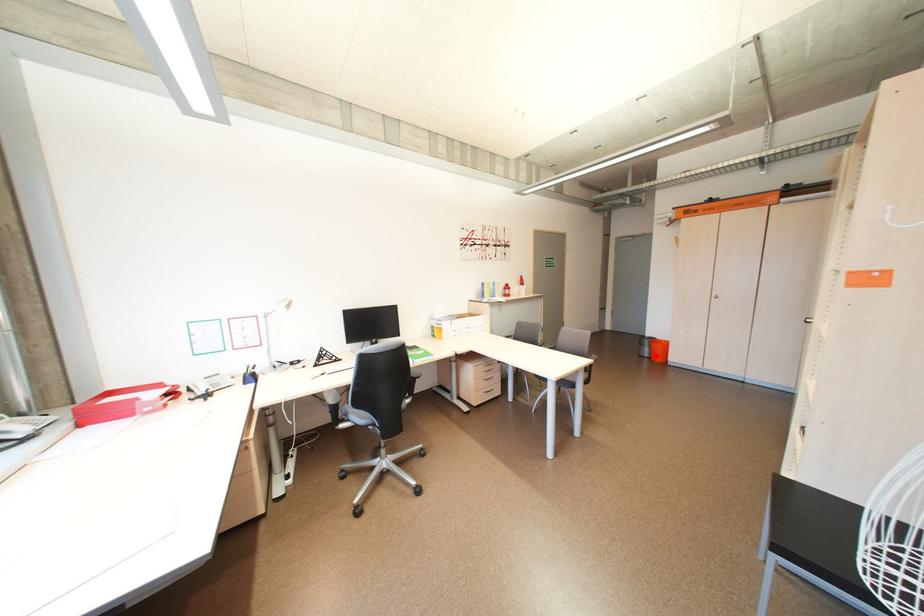
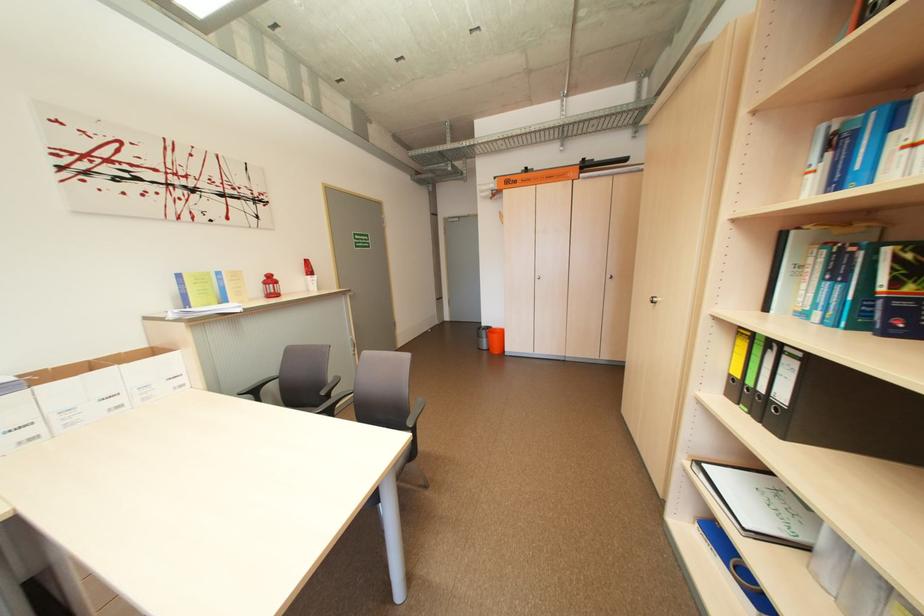
Question: I am providing you with two images of the same scene from different viewpoints. Image1 has a red point marked. In image2, the corresponding 3D location appears at what relative position? Reply with the corresponding letter.

Choices:
 (A) Closer
 (B) Farther

Answer: (A)